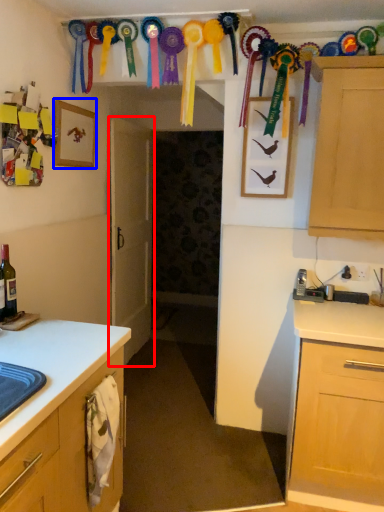
Question: Which point is further to the camera, door (highlighted by a red box) or picture frame (highlighted by a blue box)?

Choices:
 (A) door
 (B) picture frame

Answer: (A)